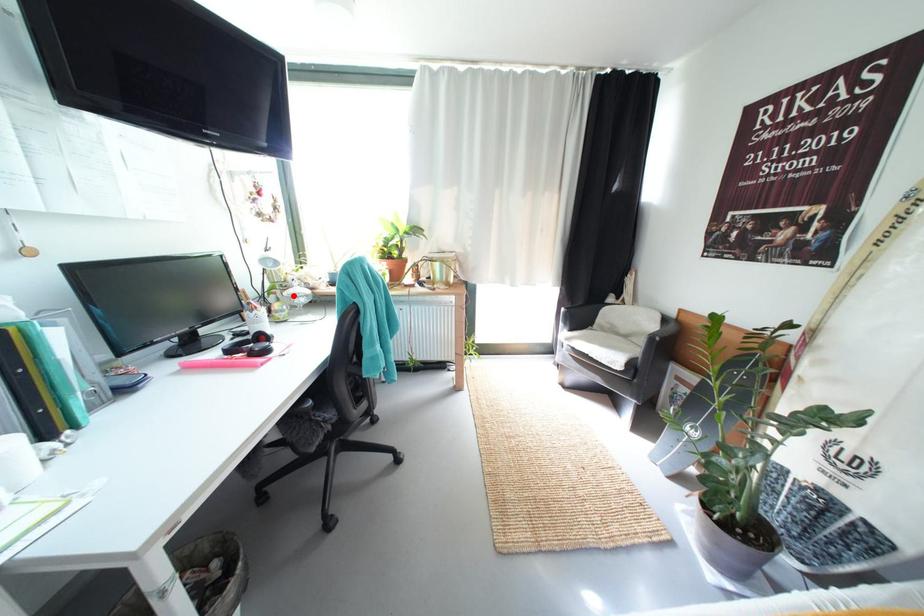
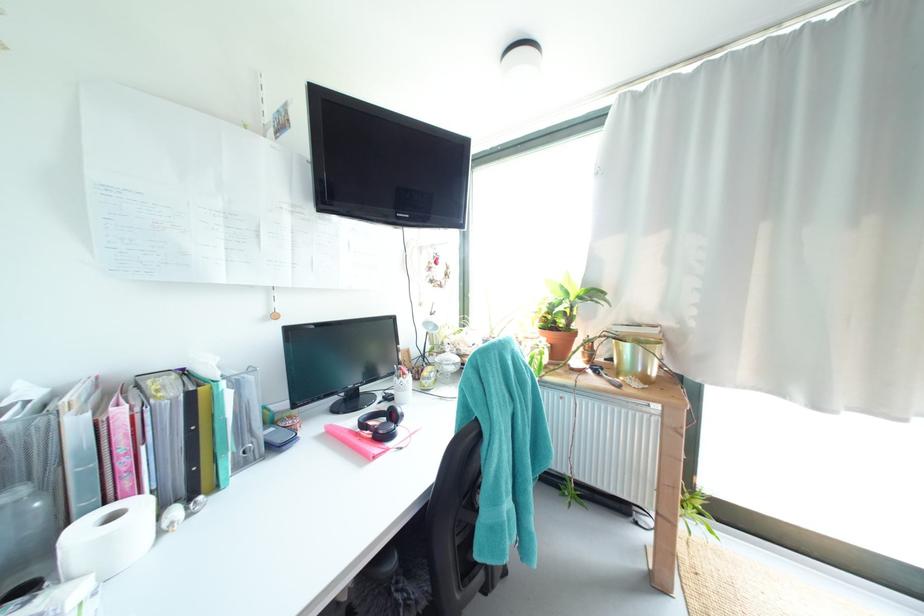
The point at the highlighted location is marked in the first image. Where is the corresponding point in the second image?

(445, 361)